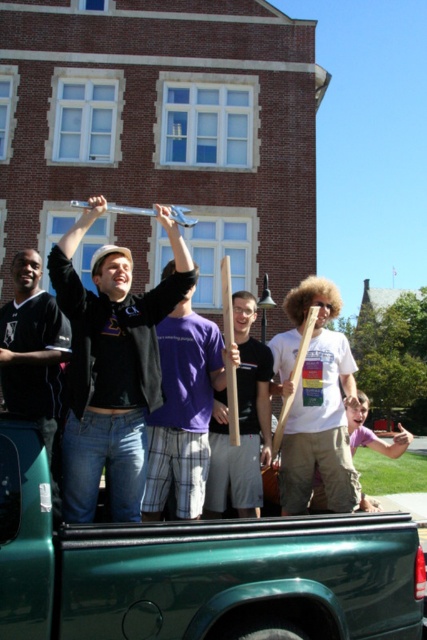
Can you confirm if wooden stick at center is shorter than purple cotton t-shirt at center?

Indeed, wooden stick at center has a lesser height compared to purple cotton t-shirt at center.

Is wooden stick at center taller than purple cotton t-shirt at center?

No, wooden stick at center is not taller than purple cotton t-shirt at center.

Does point (274, 353) lie behind point (166, 346)?

Yes, it is.

Where is `wooden stick at center`? This screenshot has width=427, height=640. wooden stick at center is located at coordinates (315, 403).

Is purple cotton t-shirt at center below matte black shirt at left?

Correct, purple cotton t-shirt at center is located below matte black shirt at left.

This screenshot has width=427, height=640. What do you see at coordinates (183, 412) in the screenshot?
I see `purple cotton t-shirt at center` at bounding box center [183, 412].

Between point (158, 454) and point (37, 365), which one is positioned in front?

Positioned in front is point (37, 365).

What are the coordinates of `purple cotton t-shirt at center` in the screenshot? It's located at (183, 412).

Does matte black shirt at left have a lesser height compared to wooden pole at center?

Yes.

Does matte black shirt at left have a greater height compared to wooden pole at center?

In fact, matte black shirt at left may be shorter than wooden pole at center.

Between point (44, 410) and point (236, 492), which one is positioned in front?

Point (44, 410) is in front.

The image size is (427, 640). I want to click on matte black shirt at left, so click(32, 348).